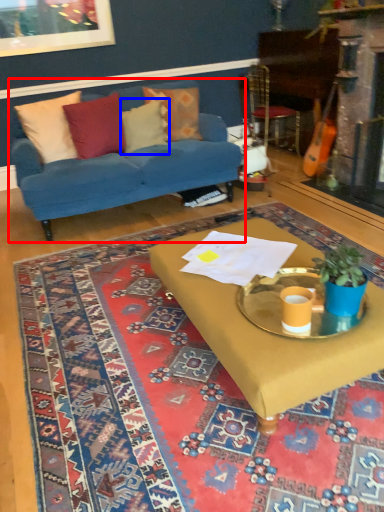
Question: Which object appears closest to the camera in this image, studio couch (highlighted by a red box) or pillow (highlighted by a blue box)?

Choices:
 (A) studio couch
 (B) pillow

Answer: (A)